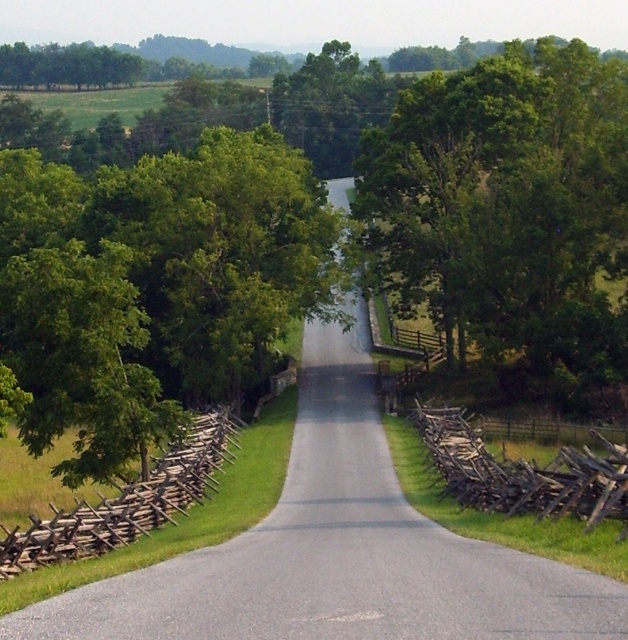
You are driving a car and want to stay on the gray asphalt road at center while avoiding the brown wooden fence at left. According to the scene description, which direction should you steer your car to stay on the road?

A: The gray asphalt road at center is located above the brown wooden fence at left. To stay on the road, you should steer your car upwards, keeping it above the fence.